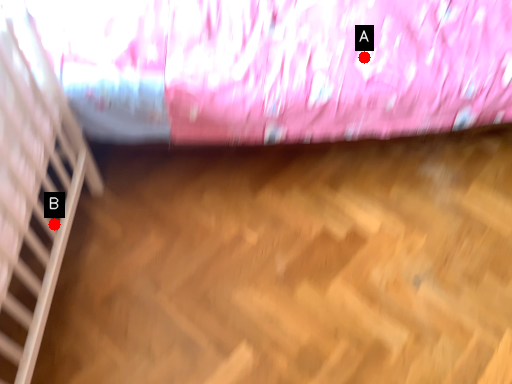
Question: Two points are circled on the image, labeled by A and B beside each circle. Which point appears farthest from the camera in this image?

Choices:
 (A) A is further
 (B) B is further

Answer: (A)